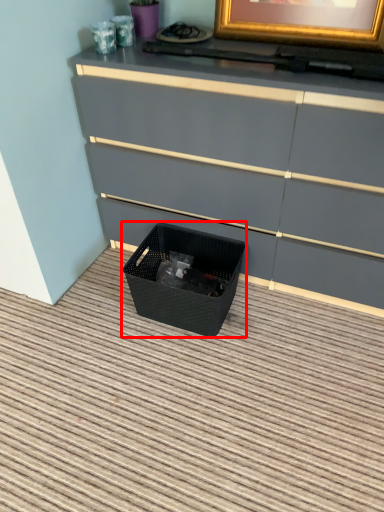
Question: In this image, where is basket container (annotated by the red box) located relative to chest of drawers?

Choices:
 (A) left
 (B) right

Answer: (A)